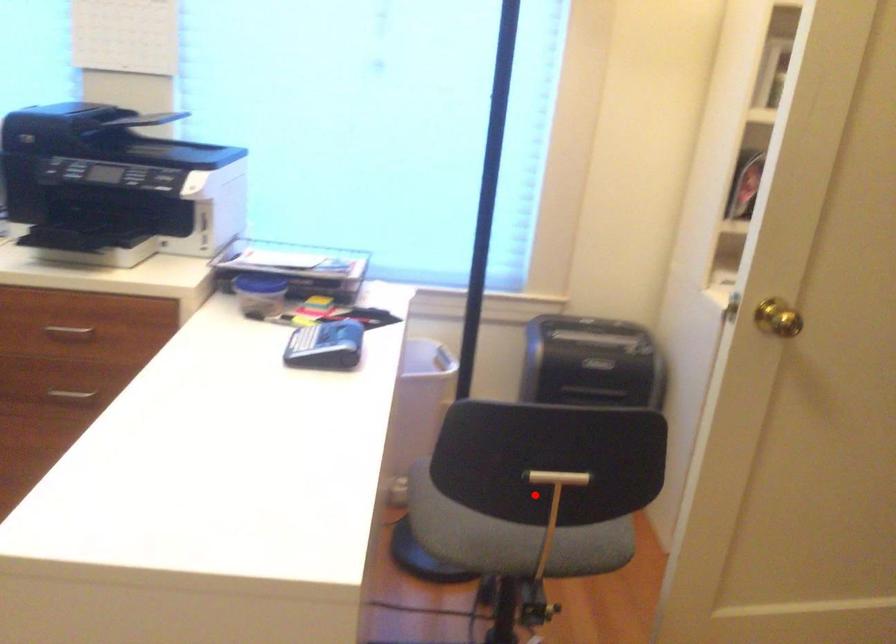
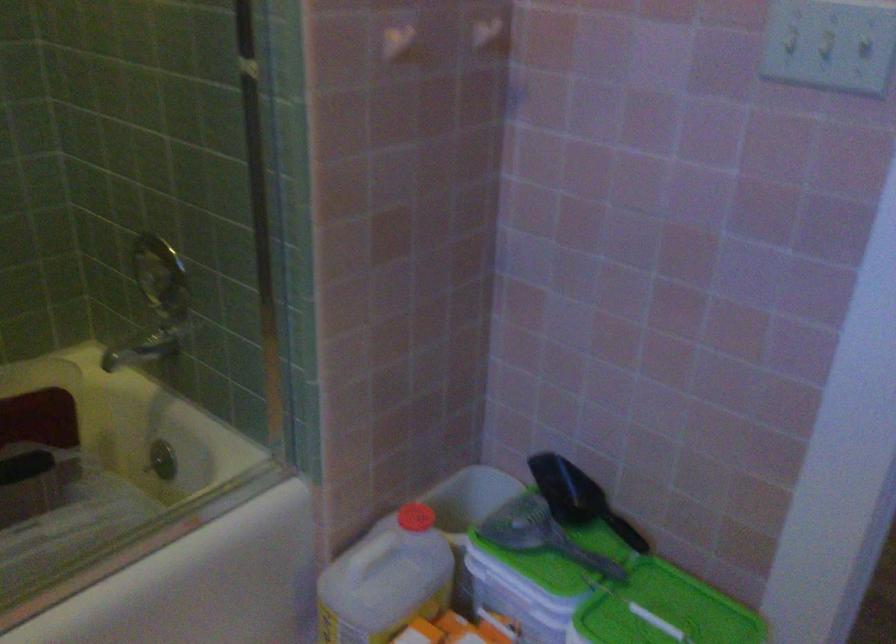
Question: I am providing you with two images of the same scene from different viewpoints. A red point is marked on the first image. Can you still see the location of the red point in image 2?

Choices:
 (A) Yes
 (B) No

Answer: (B)